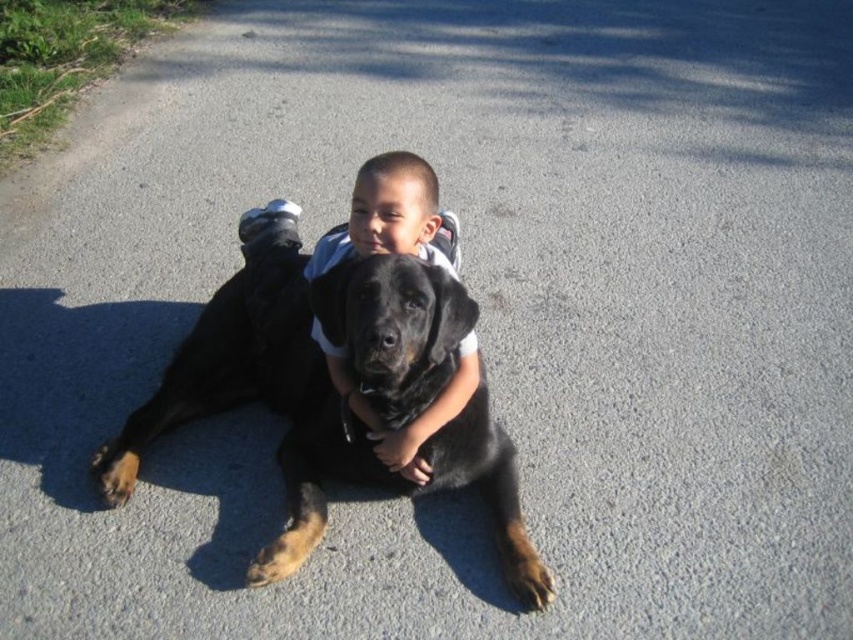
Question: Can you confirm if black fur dog at center is positioned above smooth black shirt at center?

Choices:
 (A) yes
 (B) no

Answer: (B)

Question: Observing the image, what is the correct spatial positioning of black fur dog at center in reference to smooth black shirt at center?

Choices:
 (A) below
 (B) above

Answer: (A)

Question: In this image, where is black fur dog at center located relative to smooth black shirt at center?

Choices:
 (A) left
 (B) right

Answer: (A)

Question: Which of the following is the farthest from the observer?

Choices:
 (A) (368, 424)
 (B) (323, 468)

Answer: (B)

Question: Which of the following is the closest to the observer?

Choices:
 (A) (413, 349)
 (B) (373, 193)

Answer: (A)